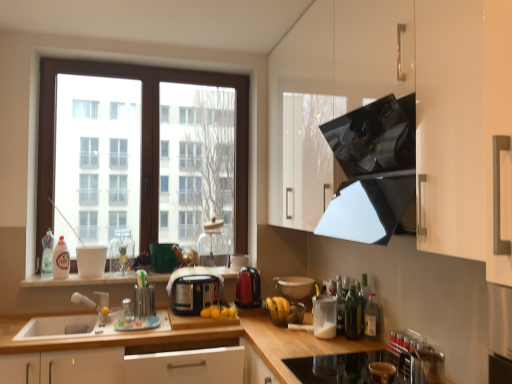
Measure the distance between point (x=296, y=343) and camera.

Point (x=296, y=343) is 2.10 meters from camera.

What do you see at coordinates (95, 304) in the screenshot?
I see `white plastic faucet at lower left` at bounding box center [95, 304].

This screenshot has width=512, height=384. What do you see at coordinates (286, 347) in the screenshot?
I see `wooden at lower center` at bounding box center [286, 347].

Find the location of `green glass bottle at lower right, which is the second bottle in right-to-left order`. green glass bottle at lower right, which is the second bottle in right-to-left order is located at coordinates (352, 314).

What is the approximate width of translucent plastic bottle at center, which is the 3th bottle in back-to-front order?

2.11 inches.

Where is `white matte cabinet at lower center, which is the second cabinetry in top-to-bottom order`? white matte cabinet at lower center, which is the second cabinetry in top-to-bottom order is located at coordinates (201, 338).

The height and width of the screenshot is (384, 512). I want to click on bottle that is the 3rd one when counting backward from the green glass bottle at lower right, which is the fourth bottle from left to right, so click(47, 254).

Is green glass bottle at lower right, which is the second bottle in right-to-left order, facing towards clear plastic bottle at left, which is the first bottle from left to right?

No, green glass bottle at lower right, which is the second bottle in right-to-left order, is not facing towards clear plastic bottle at left, which is the first bottle from left to right.

Can you tell me how much green glass bottle at lower right, placed as the second bottle when sorted from front to back, and clear plastic bottle at left, which is the first bottle from left to right, differ in facing direction?

90.9 degrees.

Is green glass bottle at lower right, the fourth bottle viewed from the back, with clear plastic bottle at left, which is the first bottle from left to right?

No, green glass bottle at lower right, the fourth bottle viewed from the back, is not beside clear plastic bottle at left, which is the first bottle from left to right.

Is white matte container at center, the second kitchen appliance in the left-to-right sequence, positioned with its back to matte brown bowl at center, placed as the third appliance when sorted from back to front?

No, white matte container at center, the second kitchen appliance in the left-to-right sequence, is not facing away from matte brown bowl at center, placed as the third appliance when sorted from back to front.

Can you tell me how much white matte container at center, arranged as the second kitchen appliance when viewed from the back, and matte brown bowl at center, placed as the third appliance when sorted from back to front, differ in facing direction?

Answer: The angle between the facing direction of white matte container at center, arranged as the second kitchen appliance when viewed from the back, and the facing direction of matte brown bowl at center, placed as the third appliance when sorted from back to front, is 91.2 degrees.

You are a GUI agent. You are given a task and a screenshot of the screen. Output one action in this format:
    pyautogui.click(x=<x>, y=<y>)
    Task: Click on the appliance that is the 1st object to the left of the white matte container at center, placed as the first kitchen appliance when sorted from front to back, starting at the anchor
    The width and height of the screenshot is (512, 384).
    Given the screenshot: What is the action you would take?
    pyautogui.click(x=296, y=288)

Considering the points (320, 313) and (310, 290), which point is in front, point (320, 313) or point (310, 290)?

Point (320, 313)

Is metallic stainless steel kettle at lower right, which ranks as the 8th appliance in back-to-front order, taller than white matte drawer at center, marked as the 3th cabinetry in a top-to-bottom arrangement?

In fact, metallic stainless steel kettle at lower right, which ranks as the 8th appliance in back-to-front order, may be shorter than white matte drawer at center, marked as the 3th cabinetry in a top-to-bottom arrangement.

Considering the sizes of objects metallic stainless steel kettle at lower right, which ranks as the 8th appliance in back-to-front order, and white matte drawer at center, marked as the 3th cabinetry in a top-to-bottom arrangement, in the image provided, who is smaller, metallic stainless steel kettle at lower right, which ranks as the 8th appliance in back-to-front order, or white matte drawer at center, marked as the 3th cabinetry in a top-to-bottom arrangement,?

metallic stainless steel kettle at lower right, which ranks as the 8th appliance in back-to-front order.

From the image's perspective, which one is positioned lower, metallic stainless steel kettle at lower right, which ranks as the 8th appliance in back-to-front order, or white matte drawer at center, marked as the 3th cabinetry in a top-to-bottom arrangement?

white matte drawer at center, marked as the 3th cabinetry in a top-to-bottom arrangement.

From the picture: Is wooden at lower center facing towards translucent glass bottle at right, the first bottle positioned from the right?

No, wooden at lower center is not facing towards translucent glass bottle at right, the first bottle positioned from the right.

Would you say wooden at lower center is inside or outside translucent glass bottle at right, placed as the 1th bottle when sorted from front to back?

wooden at lower center is spatially situated outside translucent glass bottle at right, placed as the 1th bottle when sorted from front to back.

Does wooden at lower center have a smaller size compared to translucent glass bottle at right, the first bottle positioned from the right?

No.

Consider the image. From a real-world perspective, is wooden at lower center beneath translucent glass bottle at right, which ranks as the 5th bottle in left-to-right order?

Yes, from a real-world perspective, wooden at lower center is beneath translucent glass bottle at right, which ranks as the 5th bottle in left-to-right order.

From the image's perspective, would you say glossy black exhaust hood at upper right is positioned over metallic stainless steel kettle at lower right, marked as the 1th appliance in a front-to-back arrangement?

Yes, from the image's perspective, glossy black exhaust hood at upper right is above metallic stainless steel kettle at lower right, marked as the 1th appliance in a front-to-back arrangement.

Is glossy black exhaust hood at upper right bigger than metallic stainless steel kettle at lower right, which ranks as the 8th appliance in back-to-front order?

Indeed, glossy black exhaust hood at upper right has a larger size compared to metallic stainless steel kettle at lower right, which ranks as the 8th appliance in back-to-front order.

Is glossy black exhaust hood at upper right behind metallic stainless steel kettle at lower right, which ranks as the 8th appliance in back-to-front order?

No, the depth of glossy black exhaust hood at upper right is less than that of metallic stainless steel kettle at lower right, which ranks as the 8th appliance in back-to-front order.

In the scene shown: Between glossy black exhaust hood at upper right and metallic stainless steel kettle at lower right, marked as the 1th appliance in a front-to-back arrangement, which one appears on the left side from the viewer's perspective?

Positioned to the left is glossy black exhaust hood at upper right.

In the scene shown: Considering the sizes of objects translucent glass bottle at right, placed as the 1th bottle when sorted from front to back, and glossy black exhaust hood at upper right in the image provided, who is taller, translucent glass bottle at right, placed as the 1th bottle when sorted from front to back, or glossy black exhaust hood at upper right?

Standing taller between the two is glossy black exhaust hood at upper right.

Is translucent glass bottle at right, which ranks as the 5th bottle in left-to-right order, located outside glossy black exhaust hood at upper right?

Yes, translucent glass bottle at right, which ranks as the 5th bottle in left-to-right order, is not within glossy black exhaust hood at upper right.

Between translucent glass bottle at right, which is counted as the 5th bottle, starting from the back, and glossy black exhaust hood at upper right, which one has smaller width?

Thinner between the two is translucent glass bottle at right, which is counted as the 5th bottle, starting from the back.

Are red glossy electric kettle at center, arranged as the 1th kitchen appliance when viewed from the back, and white plastic faucet at lower left far apart?

Actually, red glossy electric kettle at center, arranged as the 1th kitchen appliance when viewed from the back, and white plastic faucet at lower left are a little close together.

How much distance is there between red glossy electric kettle at center, the first kitchen appliance positioned from the left, and white plastic faucet at lower left?

The distance of red glossy electric kettle at center, the first kitchen appliance positioned from the left, from white plastic faucet at lower left is 34.00 inches.

Consider the image. Is red glossy electric kettle at center, the first kitchen appliance positioned from the left, facing towards white plastic faucet at lower left?

No, red glossy electric kettle at center, the first kitchen appliance positioned from the left, is not facing towards white plastic faucet at lower left.

From the image's perspective, between red glossy electric kettle at center, arranged as the 1th kitchen appliance when viewed from the back, and white plastic faucet at lower left, who is located below?

From the image's view, white plastic faucet at lower left is below.

From the image's perspective, starting from the clear plastic bottle at left, which is the first bottle from left to right, which bottle is the 1st one below? Please provide its 2D coordinates.

[(352, 314)]

The width and height of the screenshot is (512, 384). Identify the location of the 1st appliance counting from the left side of the white matte container at center, the second kitchen appliance in the left-to-right sequence. (296, 288).

When comparing their distances from wooden at left, does glossy black exhaust hood at upper right or translucent glass bottle at right, which is counted as the 5th bottle, starting from the back, seem closer?

translucent glass bottle at right, which is counted as the 5th bottle, starting from the back, is positioned closer to the anchor wooden at left.

From the image, which object appears to be nearer to glossy black exhaust hood at upper right, matte brown bowl at center, placed as the third appliance when sorted from back to front, or white plastic faucet at lower left?

matte brown bowl at center, placed as the third appliance when sorted from back to front, is positioned closer to the anchor glossy black exhaust hood at upper right.

From the image, which object appears to be farther from matte black toaster at center, which appears as the 5th appliance when viewed from the back, white matte container at center, the second kitchen appliance in the left-to-right sequence, or metallic green pen holder at center, which appears as the fifth appliance when viewed from the front?

white matte container at center, the second kitchen appliance in the left-to-right sequence.

Looking at the image, which one is located further to white plastic faucet at lower left, white matte cabinet at lower center, which is the second cabinetry in top-to-bottom order, or white glossy bottle at left, which is counted as the 4th bottle, starting from the right?

The object further to white plastic faucet at lower left is white matte cabinet at lower center, which is the second cabinetry in top-to-bottom order.

Estimate the real-world distances between objects in this image. Which object is closer to green glass bottle at lower right, the fourth bottle viewed from the back, metallic green pen holder at center, the 4th appliance from the back, or wooden at lower left?

wooden at lower left is closer to green glass bottle at lower right, the fourth bottle viewed from the back.

Looking at the image, which one is located further to red glossy electric kettle at center, arranged as the 1th kitchen appliance when viewed from the back, glossy black exhaust hood at upper right or white matte container at center, the second kitchen appliance in the left-to-right sequence?

glossy black exhaust hood at upper right is further to red glossy electric kettle at center, arranged as the 1th kitchen appliance when viewed from the back.

Estimate the real-world distances between objects in this image. Which object is closer to white matte drawer at center, marked as the 3th cabinetry in a top-to-bottom arrangement, black glass cooktop at lower center, placed as the second appliance when sorted from front to back, or white matte cabinet at lower center, which is the second cabinetry in top-to-bottom order?

Among the two, white matte cabinet at lower center, which is the second cabinetry in top-to-bottom order, is located nearer to white matte drawer at center, marked as the 3th cabinetry in a top-to-bottom arrangement.

Looking at the image, which one is located further to glossy white cabinet at upper right, the third cabinetry positioned from the bottom, black glass cooktop at lower center, placed as the second appliance when sorted from front to back, or clear plastic bottle at left, which is the first bottle from left to right?

clear plastic bottle at left, which is the first bottle from left to right, is positioned further to the anchor glossy white cabinet at upper right, the third cabinetry positioned from the bottom.

Where is `window sill between white glossy bottle at left, the second bottle from the back, and translucent glass bottle at right, which is counted as the 5th bottle, starting from the back, from left to right`? window sill between white glossy bottle at left, the second bottle from the back, and translucent glass bottle at right, which is counted as the 5th bottle, starting from the back, from left to right is located at coordinates [79, 280].

Where is `window sill located between wooden at lower left and red glossy electric kettle at center, the first kitchen appliance positioned from the left, in the left-right direction`? This screenshot has height=384, width=512. window sill located between wooden at lower left and red glossy electric kettle at center, the first kitchen appliance positioned from the left, in the left-right direction is located at coordinates (79, 280).

At what (x,y) coordinates should I click in order to perform the action: click on window sill positioned between black glass cooktop at lower center, arranged as the seventh appliance when viewed from the back, and matte brown bowl at center, the sixth appliance from the front, from near to far. Please return your answer as a coordinate pair (x, y). Looking at the image, I should click on (79, 280).

I want to click on exhaust hood between matte black toaster at center, marked as the 4th appliance in a front-to-back arrangement, and translucent glass bottle at right, which ranks as the 5th bottle in left-to-right order, so click(372, 170).